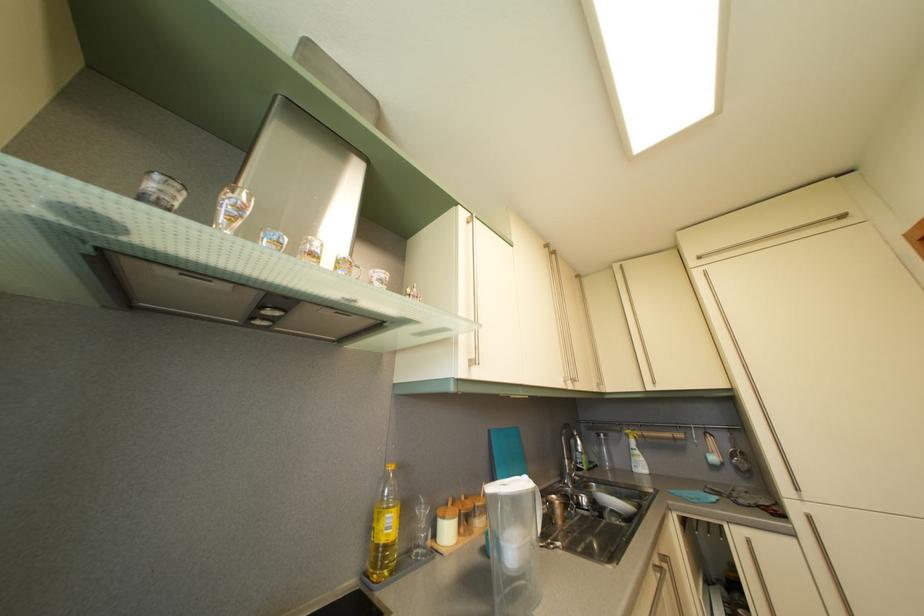
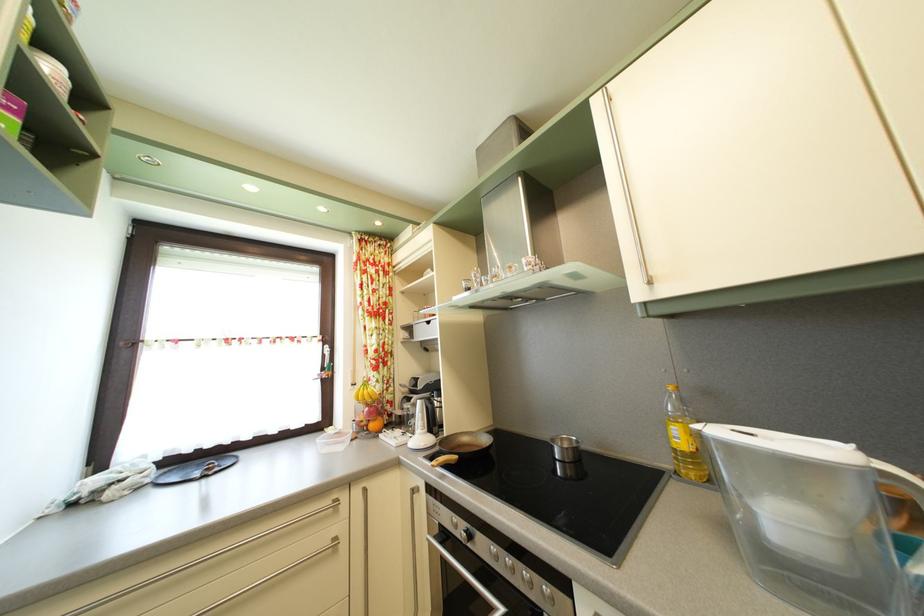
Find the pixel in the second image that matches pixel 521 554 in the first image.

(793, 528)